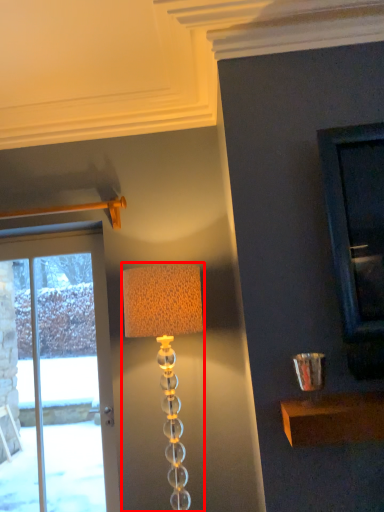
Question: From the image's perspective, what is the correct spatial relationship of lamp (annotated by the red box) in relation to door?

Choices:
 (A) above
 (B) below

Answer: (A)